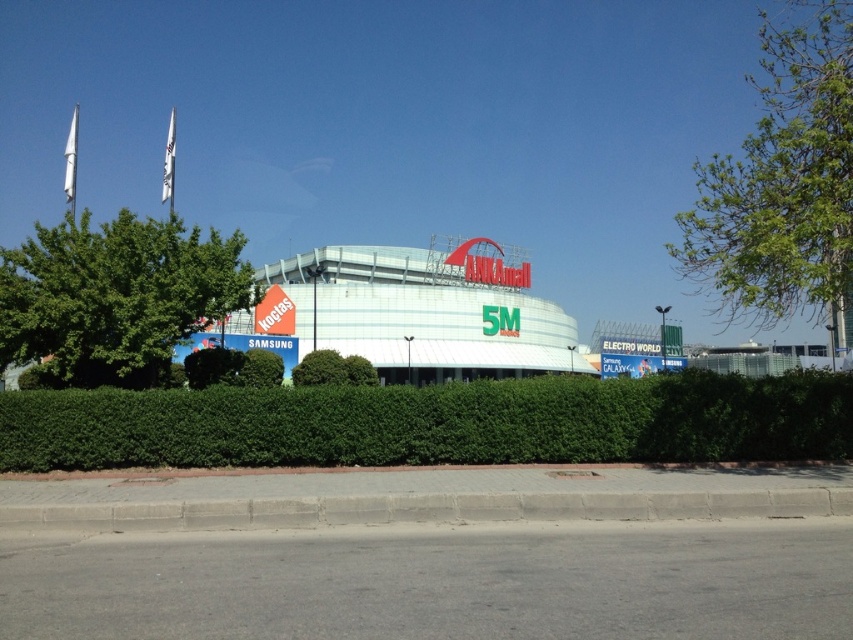
You are a visitor standing in front of the ANKAmall building. You notice a green leafy tree at right and a white glossy stadium at center. Which object is taller?

The green leafy tree at right is much taller than the white glossy stadium at center.

You are standing in front of the ANKAmall building and notice the white glossy stadium at center and the green leafy tree at left. Which object is positioned lower in the image?

The white glossy stadium at center is below the green leafy tree at left, so it is positioned lower in the image.

From the picture: You are a landscape architect planning to install a new pathway between the green leafy tree at right and the white glossy stadium at center. The pathway requires a minimum of 120 feet of space. Can the available distance accommodate the pathway?

The distance between the green leafy tree at right and the white glossy stadium at center is 139.18 feet, which exceeds the required 120 feet. Therefore, the pathway can be accommodated.